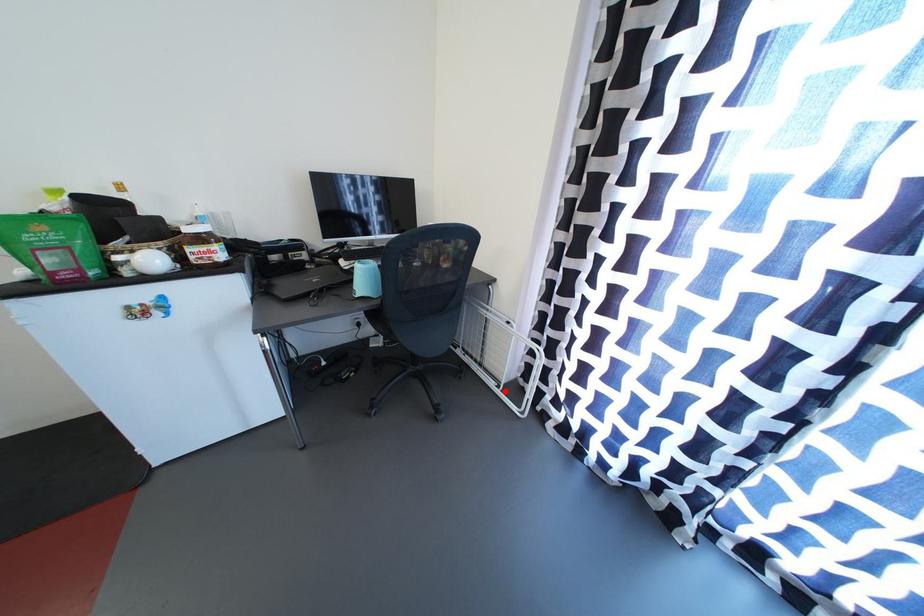
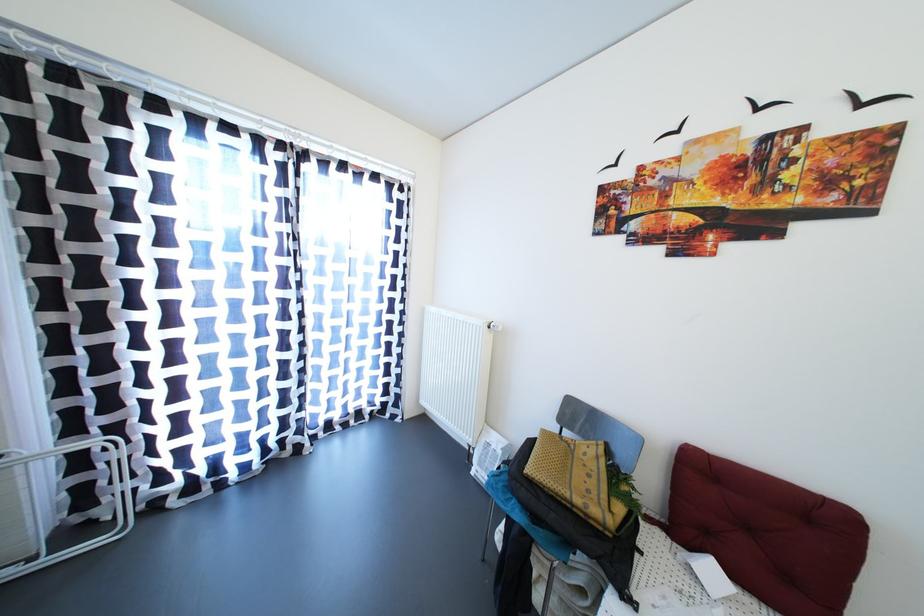
The point at the highlighted location is marked in the first image. Where is the corresponding point in the second image?

(39, 564)